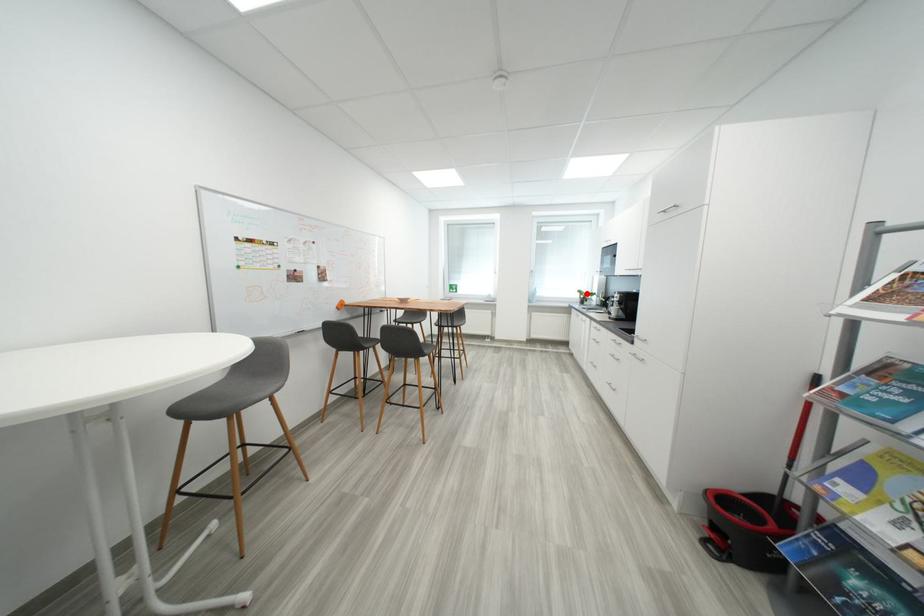
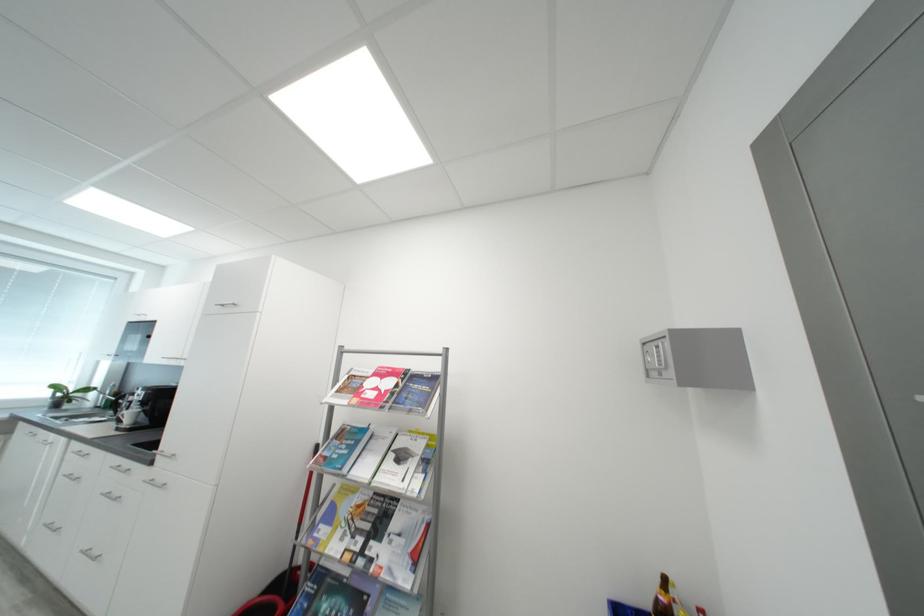
Locate, in the second image, the point that corresponds to the highlighted location in the first image.

(62, 389)